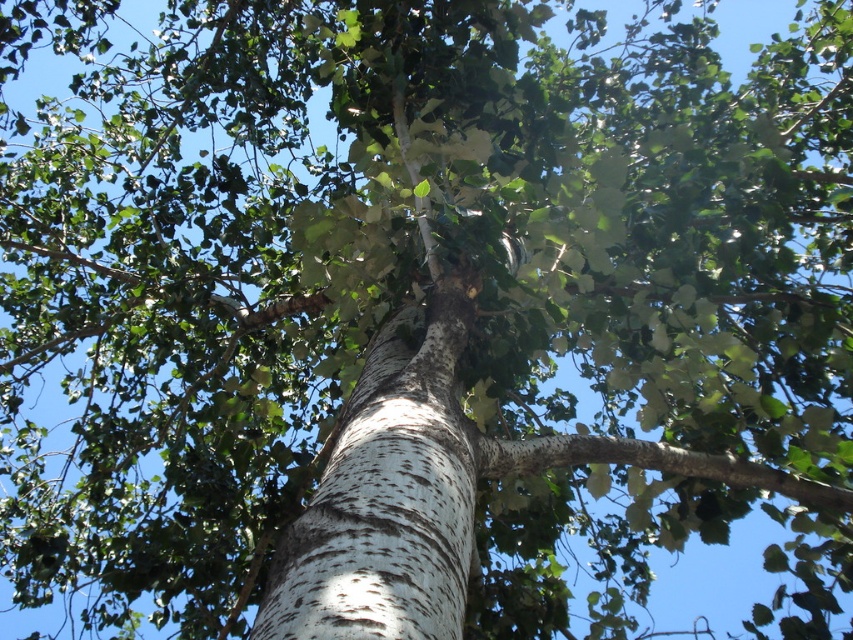
Does white speckled bark at center appear under white rough bark branch at center?

No, white speckled bark at center is not below white rough bark branch at center.

Can you confirm if white speckled bark at center is thinner than white rough bark branch at center?

Correct, white speckled bark at center's width is less than white rough bark branch at center's.

Is point (422, 380) positioned behind point (654, 445)?

No, it is not.

Image resolution: width=853 pixels, height=640 pixels. I want to click on white speckled bark at center, so click(x=387, y=496).